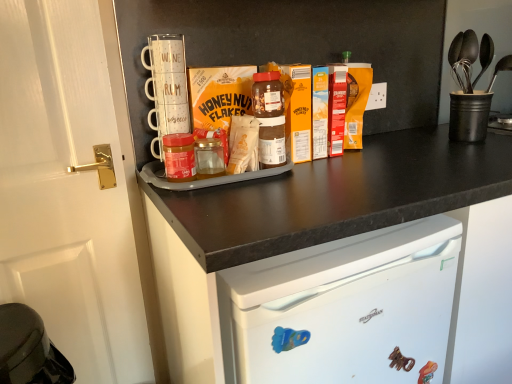
Question: Can you see matte cardboard honey nut flakes at center touching black matte cup at upper right?

Choices:
 (A) yes
 (B) no

Answer: (B)

Question: Is black matte cup at upper right surrounded by matte cardboard honey nut flakes at center?

Choices:
 (A) no
 (B) yes

Answer: (A)

Question: Can you confirm if matte cardboard honey nut flakes at center is shorter than black matte cup at upper right?

Choices:
 (A) no
 (B) yes

Answer: (B)

Question: From the image's perspective, is matte cardboard honey nut flakes at center beneath black matte cup at upper right?

Choices:
 (A) yes
 (B) no

Answer: (A)

Question: Can you confirm if matte cardboard honey nut flakes at center is taller than black matte cup at upper right?

Choices:
 (A) yes
 (B) no

Answer: (B)

Question: From a real-world perspective, is matte cardboard honey nut flakes at center under black matte cup at upper right?

Choices:
 (A) no
 (B) yes

Answer: (A)

Question: Considering the relative sizes of black matte cup at upper right and white glossy door at left in the image provided, is black matte cup at upper right bigger than white glossy door at left?

Choices:
 (A) yes
 (B) no

Answer: (B)

Question: Does black matte cup at upper right contain white glossy door at left?

Choices:
 (A) no
 (B) yes

Answer: (A)

Question: Considering the relative sizes of black matte cup at upper right and white glossy door at left in the image provided, is black matte cup at upper right shorter than white glossy door at left?

Choices:
 (A) no
 (B) yes

Answer: (B)

Question: Can you confirm if black matte cup at upper right is thinner than white glossy door at left?

Choices:
 (A) yes
 (B) no

Answer: (B)

Question: From the image's perspective, is black matte cup at upper right under white glossy door at left?

Choices:
 (A) no
 (B) yes

Answer: (A)

Question: Is black matte cup at upper right aimed at white glossy door at left?

Choices:
 (A) yes
 (B) no

Answer: (B)

Question: Can matte glass jar at center be found inside black matte cup at upper right?

Choices:
 (A) no
 (B) yes

Answer: (A)